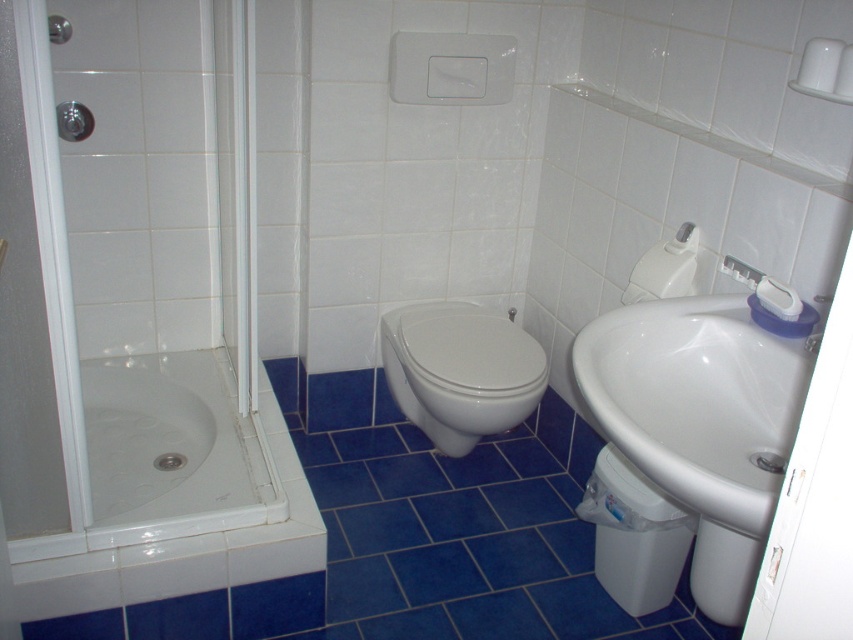
Question: Is white glossy sink at right to the left of brushed metal shower at upper left from the viewer's perspective?

Choices:
 (A) yes
 (B) no

Answer: (B)

Question: Which object is farther from the camera taking this photo?

Choices:
 (A) white glossy bidet at lower right
 (B) white glossy sink at right

Answer: (A)

Question: In this image, where is white plastic screen door at right located relative to white glossy bidet at lower right?

Choices:
 (A) left
 (B) right

Answer: (A)

Question: Which of these objects is positioned closest to the white glossy shower tray at lower left?

Choices:
 (A) white glossy bidet at center
 (B) matte silver shower at upper left
 (C) white plastic screen door at right

Answer: (A)

Question: Which point is closer to the camera?

Choices:
 (A) (86, 115)
 (B) (55, 38)
 (C) (726, 269)

Answer: (C)

Question: Does white glossy sink at right have a smaller size compared to white plastic screen door at right?

Choices:
 (A) yes
 (B) no

Answer: (B)